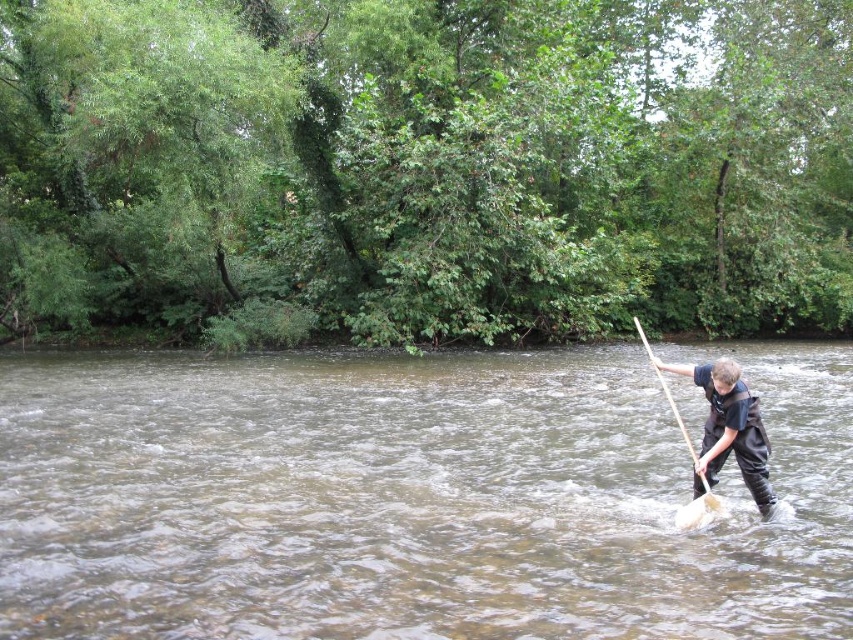
Question: Which point is closer to the camera?

Choices:
 (A) (720, 445)
 (B) (689, 522)

Answer: (A)

Question: Which object appears farthest from the camera in this image?

Choices:
 (A) dark blue fabric at right
 (B) wooden paddle at right
 (C) brown muddy water at center

Answer: (B)

Question: Does dark blue fabric at right have a larger size compared to wooden paddle at right?

Choices:
 (A) yes
 (B) no

Answer: (B)

Question: Is brown muddy water at center to the left of dark blue fabric at right from the viewer's perspective?

Choices:
 (A) no
 (B) yes

Answer: (B)

Question: Which object is farther from the camera taking this photo?

Choices:
 (A) brown muddy water at center
 (B) wooden paddle at right
 (C) dark blue fabric at right

Answer: (B)

Question: Is brown muddy water at center further to camera compared to wooden paddle at right?

Choices:
 (A) yes
 (B) no

Answer: (B)